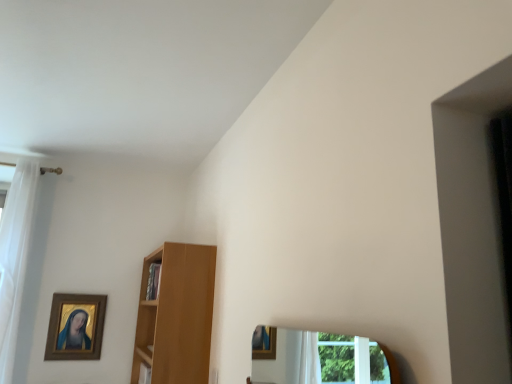
Question: From the image's perspective, is gold-framed painting at upper left located beneath white sheer curtain at left?

Choices:
 (A) yes
 (B) no

Answer: (A)

Question: From a real-world perspective, is gold-framed painting at upper left located beneath white sheer curtain at left?

Choices:
 (A) no
 (B) yes

Answer: (B)

Question: Is gold-framed painting at upper left turned away from white sheer curtain at left?

Choices:
 (A) yes
 (B) no

Answer: (B)

Question: Is gold-framed painting at upper left next to white sheer curtain at left?

Choices:
 (A) no
 (B) yes

Answer: (A)

Question: From the image's perspective, is gold-framed painting at upper left above white sheer curtain at left?

Choices:
 (A) no
 (B) yes

Answer: (A)

Question: Considering the positions of point (147, 324) and point (59, 326), is point (147, 324) closer or farther from the camera than point (59, 326)?

Choices:
 (A) farther
 (B) closer

Answer: (B)

Question: Is light brown wooden shelf at center bigger or smaller than gold-framed painting at upper left?

Choices:
 (A) big
 (B) small

Answer: (A)

Question: Would you say light brown wooden shelf at center is inside or outside gold-framed painting at upper left?

Choices:
 (A) outside
 (B) inside

Answer: (A)

Question: From the image's perspective, is light brown wooden shelf at center above or below gold-framed painting at upper left?

Choices:
 (A) above
 (B) below

Answer: (A)

Question: Considering the positions of gold-framed painting at upper left and light brown wooden shelf at center in the image, is gold-framed painting at upper left taller or shorter than light brown wooden shelf at center?

Choices:
 (A) tall
 (B) short

Answer: (B)

Question: Do you think gold-framed painting at upper left is within light brown wooden shelf at center, or outside of it?

Choices:
 (A) outside
 (B) inside

Answer: (A)

Question: Based on their sizes in the image, would you say gold-framed painting at upper left is bigger or smaller than light brown wooden shelf at center?

Choices:
 (A) small
 (B) big

Answer: (A)

Question: Is point (82, 340) closer or farther from the camera than point (192, 281)?

Choices:
 (A) closer
 (B) farther

Answer: (B)

Question: Looking at the image, does white sheer curtain at left seem bigger or smaller compared to wooden cabinet at center?

Choices:
 (A) small
 (B) big

Answer: (B)

Question: Considering the positions of white sheer curtain at left and wooden cabinet at center in the image, is white sheer curtain at left wider or thinner than wooden cabinet at center?

Choices:
 (A) thin
 (B) wide

Answer: (B)